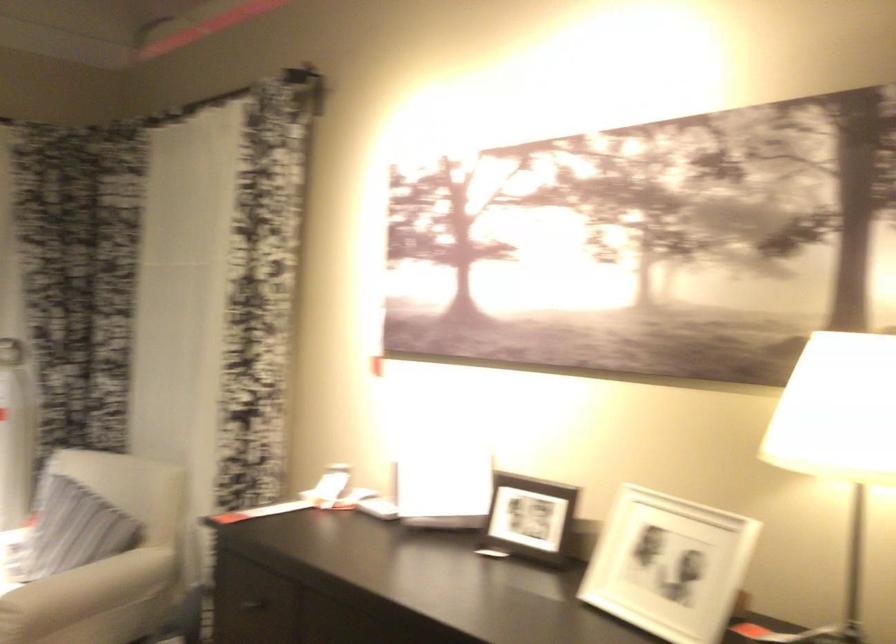
The width and height of the screenshot is (896, 644). What do you see at coordinates (15, 540) in the screenshot? I see `the chair sitting surface` at bounding box center [15, 540].